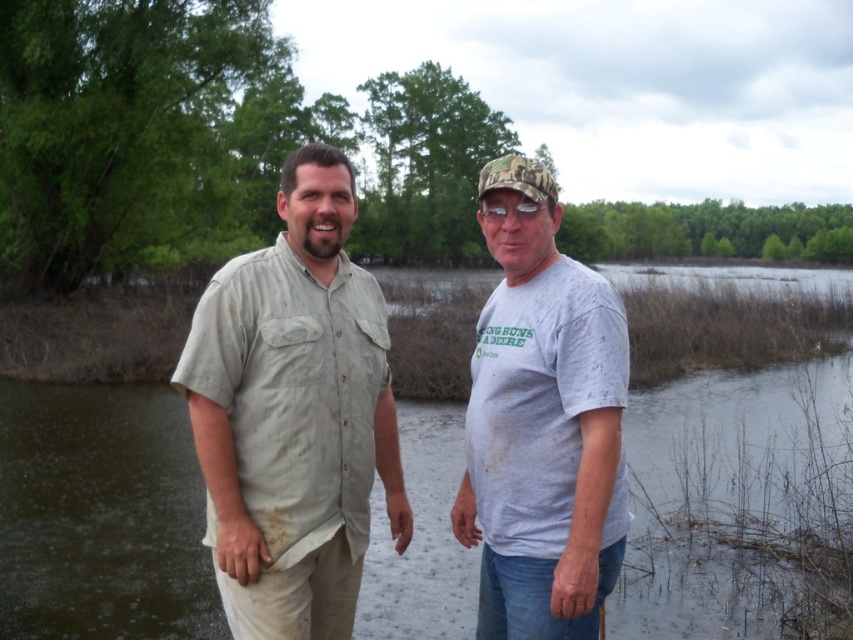
Can you confirm if light beige cotton shirt at center is smaller than white cotton t-shirt at center?

No.

Is light beige cotton shirt at center bigger than white cotton t-shirt at center?

Correct, light beige cotton shirt at center is larger in size than white cotton t-shirt at center.

Measure the distance between light beige cotton shirt at center and camera.

The distance of light beige cotton shirt at center from camera is 3.41 meters.

Image resolution: width=853 pixels, height=640 pixels. I want to click on light beige cotton shirt at center, so pyautogui.click(x=294, y=413).

The width and height of the screenshot is (853, 640). What do you see at coordinates (100, 516) in the screenshot? I see `brown muddy water at center` at bounding box center [100, 516].

Looking at this image, can you confirm if brown muddy water at center is bigger than white cotton t-shirt at center?

Yes.

Which is in front, point (49, 390) or point (485, 461)?

Point (485, 461) is more forward.

Where is `brown muddy water at center`? This screenshot has height=640, width=853. brown muddy water at center is located at coordinates (100, 516).

Does brown muddy water at center have a lesser height compared to light beige cotton shirt at center?

Yes, brown muddy water at center is shorter than light beige cotton shirt at center.

Based on the photo, which is more to the right, brown muddy water at center or light beige cotton shirt at center?

brown muddy water at center

Which is behind, point (30, 592) or point (320, 200)?

The point (30, 592) is behind.

Find the location of a particular element. The height and width of the screenshot is (640, 853). brown muddy water at center is located at coordinates (100, 516).